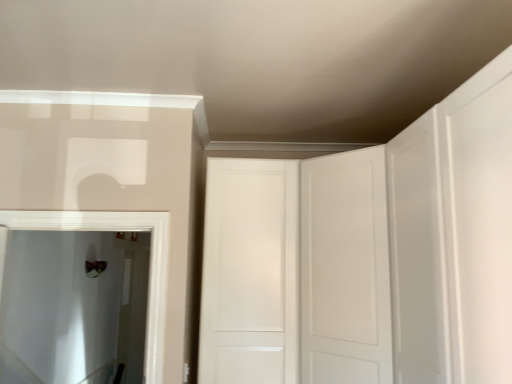
You are a GUI agent. You are given a task and a screenshot of the screen. Output one action in this format:
    pyautogui.click(x=<x>, y=<y>)
    Task: Click on the white matte door at center
    
    Given the screenshot: What is the action you would take?
    point(296,271)

What do you see at coordinates (296, 271) in the screenshot?
I see `white matte door at center` at bounding box center [296, 271].

This screenshot has width=512, height=384. Find the location of `white matte door at center`. white matte door at center is located at coordinates (296, 271).